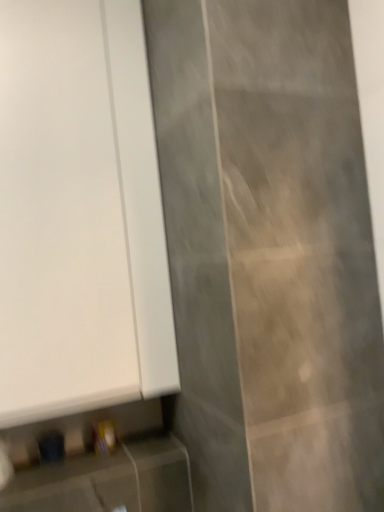
The image size is (384, 512). I want to click on white matte door at upper left, so click(x=79, y=213).

Describe the element at coordinates (79, 213) in the screenshot. The height and width of the screenshot is (512, 384). I see `white matte door at upper left` at that location.

In order to face white matte door at upper left, should I rotate leftwards or rightwards?

A 16.236 degree turn to the left will do.

Consider the image. Measure the distance between white matte door at upper left and camera.

white matte door at upper left and camera are 37.38 inches apart.

What is the approximate width of matte white cabinet at lower left?

matte white cabinet at lower left is 8.05 inches wide.

Where is `matte white cabinet at lower left`? matte white cabinet at lower left is located at coordinates (109, 481).

What do you see at coordinates (109, 481) in the screenshot? Image resolution: width=384 pixels, height=512 pixels. I see `matte white cabinet at lower left` at bounding box center [109, 481].

This screenshot has height=512, width=384. Find the location of `white matte door at upper left`. white matte door at upper left is located at coordinates (79, 213).

Considering the positions of objects white matte door at upper left and matte white cabinet at lower left in the image provided, who is more to the right, white matte door at upper left or matte white cabinet at lower left?

Positioned to the right is matte white cabinet at lower left.

Consider the image. Which object is further away from the camera, white matte door at upper left or matte white cabinet at lower left?

white matte door at upper left is more distant.

Between point (114, 143) and point (34, 507), which one is positioned behind?

The point (114, 143) is more distant.

From the image's perspective, is white matte door at upper left located above or below matte white cabinet at lower left?

white matte door at upper left is situated higher than matte white cabinet at lower left in the image.

From a real-world perspective, between white matte door at upper left and matte white cabinet at lower left, who is vertically lower?

In real-world perspective, matte white cabinet at lower left is lower.

Is white matte door at upper left wider or thinner than matte white cabinet at lower left?

white matte door at upper left is thinner than matte white cabinet at lower left.

Considering the relative sizes of white matte door at upper left and matte white cabinet at lower left in the image provided, is white matte door at upper left shorter than matte white cabinet at lower left?

No.

Looking at the image, does white matte door at upper left seem bigger or smaller compared to matte white cabinet at lower left?

Considering their sizes, white matte door at upper left takes up more space than matte white cabinet at lower left.

Do you think white matte door at upper left is within matte white cabinet at lower left, or outside of it?

The correct answer is: outside.

Is white matte door at upper left touching matte white cabinet at lower left?

No, white matte door at upper left is not making contact with matte white cabinet at lower left.

Is matte white cabinet at lower left at the back of white matte door at upper left?

No, matte white cabinet at lower left is not at the back of white matte door at upper left.

Based on the photo, how different are the orientations of white matte door at upper left and matte white cabinet at lower left in degrees?

white matte door at upper left and matte white cabinet at lower left are facing 0.0244 degrees away from each other.

At what (x,y) coordinates should I click in order to perform the action: click on door on the left of matte white cabinet at lower left. Please return your answer as a coordinate pair (x, y). Image resolution: width=384 pixels, height=512 pixels. Looking at the image, I should click on (79, 213).

Looking at this image, is matte white cabinet at lower left at the left side of white matte door at upper left?

Incorrect, matte white cabinet at lower left is not on the left side of white matte door at upper left.

Relative to white matte door at upper left, is matte white cabinet at lower left in front or behind?

Clearly, matte white cabinet at lower left is in front of white matte door at upper left.

Which is closer to the camera, [72,477] or [154,268]?

The point [72,477] is in front.

From the image's perspective, relative to white matte door at upper left, is matte white cabinet at lower left above or below?

matte white cabinet at lower left is below white matte door at upper left.

Looking at this image, from a real-world perspective, who is located lower, matte white cabinet at lower left or white matte door at upper left?

In real-world perspective, matte white cabinet at lower left is lower.

Which of these two, matte white cabinet at lower left or white matte door at upper left, is wider?

With larger width is matte white cabinet at lower left.

Between matte white cabinet at lower left and white matte door at upper left, which one has less height?

With less height is matte white cabinet at lower left.

Who is smaller, matte white cabinet at lower left or white matte door at upper left?

matte white cabinet at lower left.

Is matte white cabinet at lower left inside the boundaries of white matte door at upper left, or outside?

matte white cabinet at lower left cannot be found inside white matte door at upper left.

Based on the photo, is matte white cabinet at lower left beside white matte door at upper left?

No, matte white cabinet at lower left is not making contact with white matte door at upper left.

Is matte white cabinet at lower left turned away from white matte door at upper left?

No.

You are a GUI agent. You are given a task and a screenshot of the screen. Output one action in this format:
    pyautogui.click(x=<x>, y=<y>)
    Task: Click on the cabinetry lying on the right of white matte door at upper left
    This screenshot has height=512, width=384.
    Given the screenshot: What is the action you would take?
    pyautogui.click(x=109, y=481)

In the image, there is a white matte door at upper left. Where is `cabinetry below it (from a real-world perspective)`? cabinetry below it (from a real-world perspective) is located at coordinates (109, 481).

In the image, there is a white matte door at upper left. Where is `cabinetry below it (from the image's perspective)`? This screenshot has width=384, height=512. cabinetry below it (from the image's perspective) is located at coordinates (109, 481).